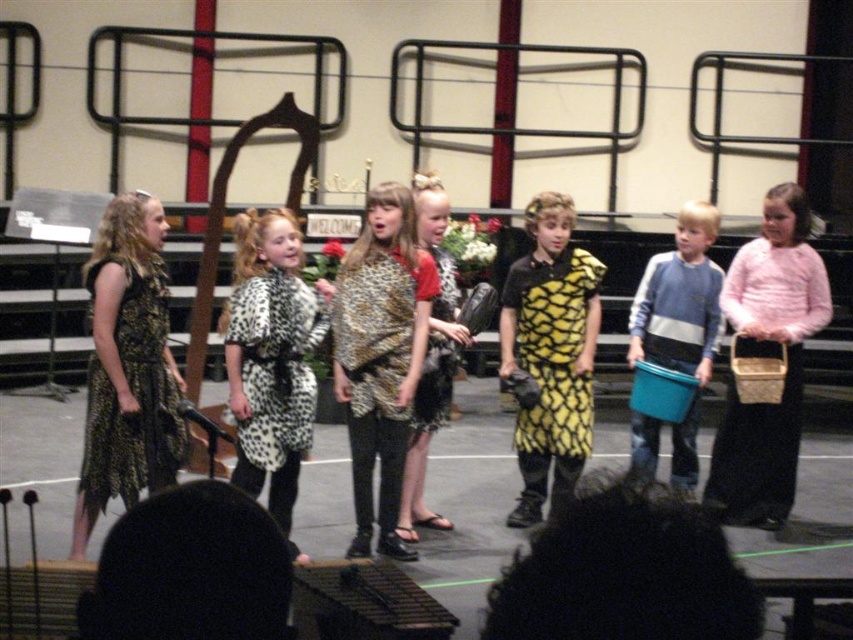
Between blue plastic bucket at center and leopard print fabric shawl at center, which one is positioned lower?

blue plastic bucket at center is lower down.

Does blue plastic bucket at center have a lesser width compared to leopard print fabric shawl at center?

In fact, blue plastic bucket at center might be wider than leopard print fabric shawl at center.

Who is more forward, (715, 236) or (360, 284)?

Positioned in front is point (360, 284).

Where is `blue plastic bucket at center`? The width and height of the screenshot is (853, 640). blue plastic bucket at center is located at coordinates (682, 323).

This screenshot has width=853, height=640. What do you see at coordinates (767, 356) in the screenshot? I see `pink wool sweater at right` at bounding box center [767, 356].

Consider the image. Can you confirm if pink wool sweater at right is taller than yellow leopard print dress at center?

Yes.

This screenshot has height=640, width=853. I want to click on pink wool sweater at right, so click(x=767, y=356).

What are the coordinates of `pink wool sweater at right` in the screenshot? It's located at (767, 356).

How far apart are leopard print scarf at center and pink wool sweater at right?

leopard print scarf at center is 2.19 meters away from pink wool sweater at right.

Is point (404, 240) positioned in front of point (772, 320)?

Yes, point (404, 240) is in front of point (772, 320).

Locate an element on the screen. leopard print scarf at center is located at coordinates (381, 355).